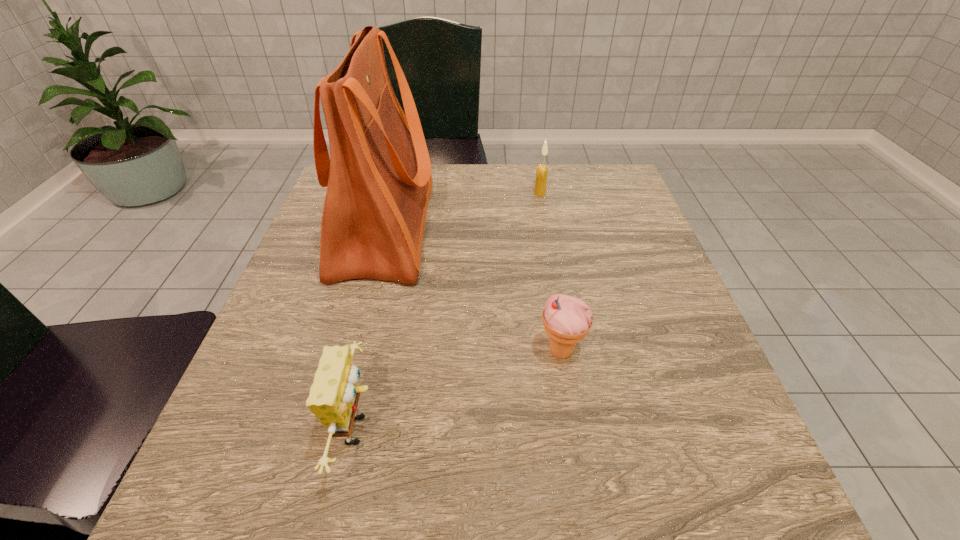
You are a GUI agent. You are given a task and a screenshot of the screen. Output one action in this format:
    pyautogui.click(x=<x>, y=<y>)
    Task: Click on the shopping bag
    The image size is (960, 540).
    Given the screenshot: What is the action you would take?
    pyautogui.click(x=378, y=177)

Image resolution: width=960 pixels, height=540 pixels. In order to click on candle in this screenshot , I will do `click(542, 171)`.

Identify the location of the third farthest object. This screenshot has height=540, width=960. (567, 320).

Identify the location of sponge. Image resolution: width=960 pixels, height=540 pixels. (334, 395).

Find the location of a particular element. This screenshot has height=540, width=960. free space located on the front pocket of the tallest object is located at coordinates [600, 228].

This screenshot has width=960, height=540. I want to click on vacant space located on the front of the candle, so click(543, 212).

You are a GUI agent. You are given a task and a screenshot of the screen. Output one action in this format:
    pyautogui.click(x=<x>, y=<y>)
    Task: Click on the free spot located on the front of the icecream
    The width and height of the screenshot is (960, 540).
    Given the screenshot: What is the action you would take?
    pyautogui.click(x=577, y=449)

Where is `vacant point located 0.230m on the face of the nearest object`? vacant point located 0.230m on the face of the nearest object is located at coordinates (529, 430).

Locate an element on the screen. Image resolution: width=960 pixels, height=540 pixels. shopping bag situated at the far edge is located at coordinates (378, 177).

Where is `candle situated at the far edge`? The width and height of the screenshot is (960, 540). candle situated at the far edge is located at coordinates tap(542, 171).